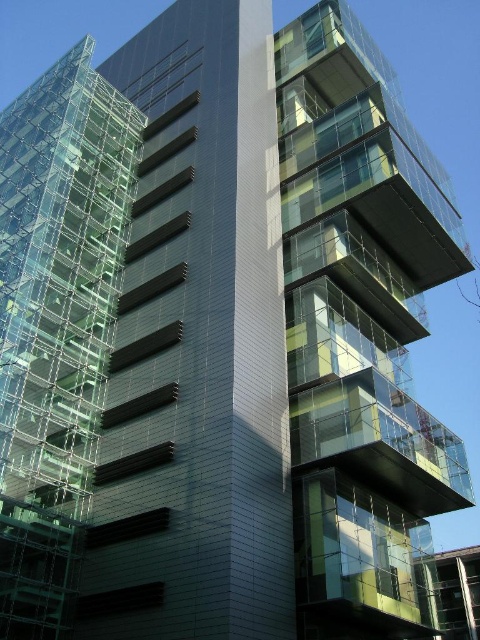
Identify the location of transparent glass building at upper right. This screenshot has width=480, height=640. (360, 333).

From the picture: Does transparent glass building at upper right have a greater height compared to transparent glass scaffolding at left?

Yes, transparent glass building at upper right is taller than transparent glass scaffolding at left.

Does point (360, 340) come farther from viewer compared to point (74, 360)?

Yes.

Locate an element on the screen. transparent glass building at upper right is located at coordinates (360, 333).